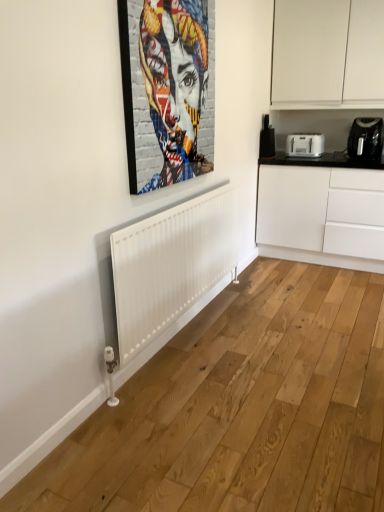
Question: Is metallic silver picture frame at upper center inside the boundaries of white plastic toaster at upper right, or outside?

Choices:
 (A) inside
 (B) outside

Answer: (B)

Question: Looking at their shapes, would you say metallic silver picture frame at upper center is wider or thinner than white plastic toaster at upper right?

Choices:
 (A) thin
 (B) wide

Answer: (A)

Question: Considering the real-world distances, which object is closest to the black plastic toaster at upper right, the second appliance when ordered from right to left?

Choices:
 (A) white matte cabinet at upper right, the 1th cabinetry from the top
 (B) metallic silver picture frame at upper center
 (C) white matte cabinet at right, marked as the second cabinetry in a top-to-bottom arrangement
 (D) white plastic toaster at upper right
 (E) black plastic toaster at upper right, placed as the 2th appliance when sorted from left to right

Answer: (D)

Question: Based on their relative distances, which object is farther from the black plastic toaster at upper right, the second appliance when ordered from right to left?

Choices:
 (A) black plastic toaster at upper right, placed as the 2th appliance when sorted from left to right
 (B) white matte cabinet at upper right, the 1th cabinetry from the top
 (C) metallic silver picture frame at upper center
 (D) white plastic toaster at upper right
 (E) white matte cabinet at right, marked as the second cabinetry in a top-to-bottom arrangement

Answer: (C)